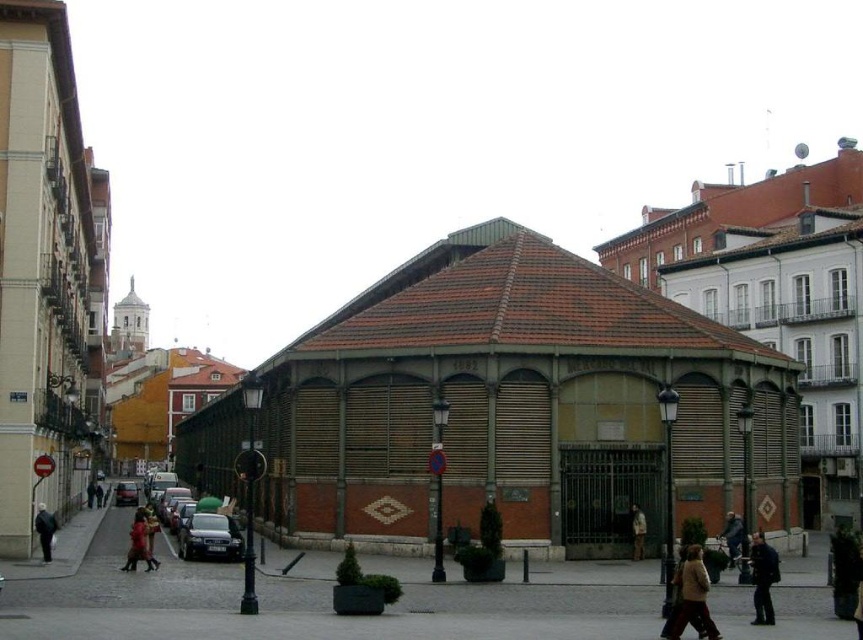
How far apart are red cotton shirt at center and dark gray jacket at lower left?

The distance of red cotton shirt at center from dark gray jacket at lower left is 4.71 meters.

Measure the distance from red cotton shirt at center to dark gray jacket at lower left.

4.71 meters

Which is in front, point (137, 534) or point (43, 529)?

Point (137, 534)

This screenshot has width=863, height=640. In order to click on red cotton shirt at center in this screenshot , I will do `click(139, 544)`.

What are the coordinates of `light brown leather jacket at lower right` in the screenshot? It's located at (693, 595).

Looking at this image, is light brown leather jacket at lower right smaller than dark blue jacket at center?

No, light brown leather jacket at lower right is not smaller than dark blue jacket at center.

Is point (710, 636) more distant than point (721, 536)?

No.

Where is `light brown leather jacket at lower right`? This screenshot has width=863, height=640. light brown leather jacket at lower right is located at coordinates (693, 595).

Does dark blue jacket at lower right have a lesser height compared to dark brown leather jacket at center?

Incorrect, dark blue jacket at lower right's height does not fall short of dark brown leather jacket at center's.

Who is higher up, dark blue jacket at lower right or dark brown leather jacket at center?

dark blue jacket at lower right

Image resolution: width=863 pixels, height=640 pixels. What do you see at coordinates (761, 579) in the screenshot? I see `dark blue jacket at lower right` at bounding box center [761, 579].

Locate an element on the screen. Image resolution: width=863 pixels, height=640 pixels. dark blue jacket at lower right is located at coordinates (761, 579).